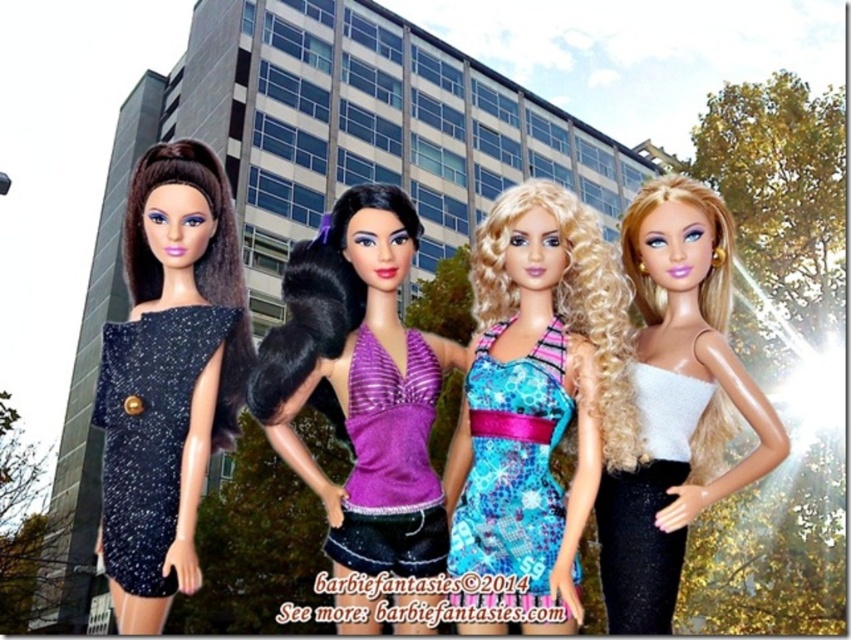
Question: Which of the following is the closest to the observer?

Choices:
 (A) (724, 316)
 (B) (433, 492)
 (C) (535, 406)

Answer: (C)

Question: Is blue printed fabric dress at center positioned before white sequined dress at right?

Choices:
 (A) yes
 (B) no

Answer: (A)

Question: Is shiny blue dress at center closer to camera compared to blue printed fabric dress at center?

Choices:
 (A) no
 (B) yes

Answer: (B)

Question: Which point appears closest to the camera in this image?

Choices:
 (A) (549, 413)
 (B) (646, 627)

Answer: (A)

Question: Does purple shiny halter top at center appear over purple glitter halter top at center?

Choices:
 (A) yes
 (B) no

Answer: (A)

Question: Which of these objects is positioned farthest from the purple shiny halter top at center?

Choices:
 (A) blue printed fabric dress at center
 (B) white sequined dress at right
 (C) sparkly black dress at left
 (D) shiny blue dress at center

Answer: (B)